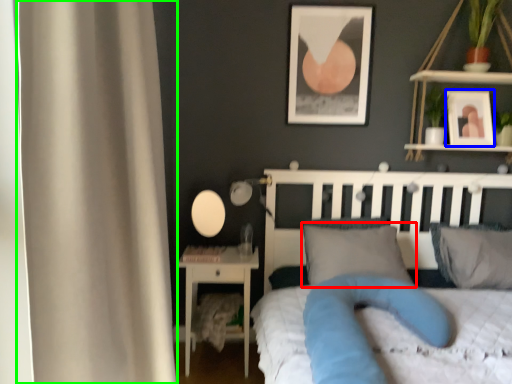
Question: Which is farther away from pillow (highlighted by a red box)? picture frame (highlighted by a blue box) or curtain (highlighted by a green box)?

Choices:
 (A) picture frame
 (B) curtain

Answer: (B)